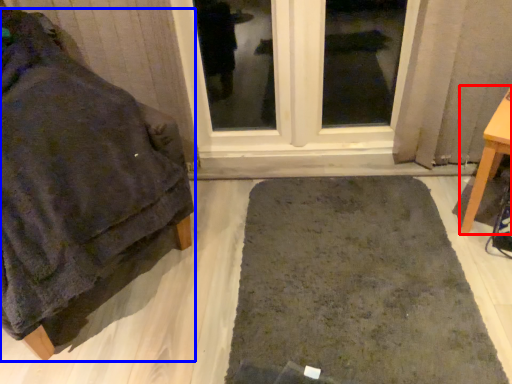
Question: Which object is further to the camera taking this photo, furniture (highlighted by a red box) or furniture (highlighted by a blue box)?

Choices:
 (A) furniture
 (B) furniture

Answer: (A)